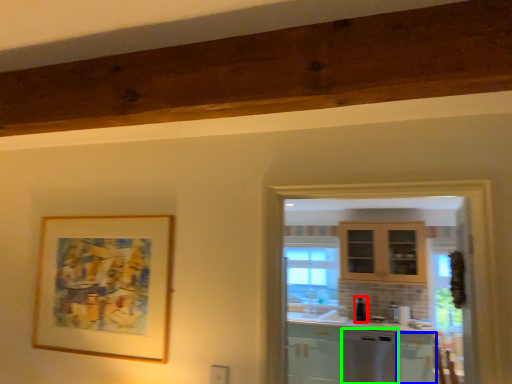
Question: Considering the real-world distances, which object is farthest from appliance (highlighted by a red box)? cabinetry (highlighted by a blue box) or dish washer (highlighted by a green box)?

Choices:
 (A) cabinetry
 (B) dish washer

Answer: (A)